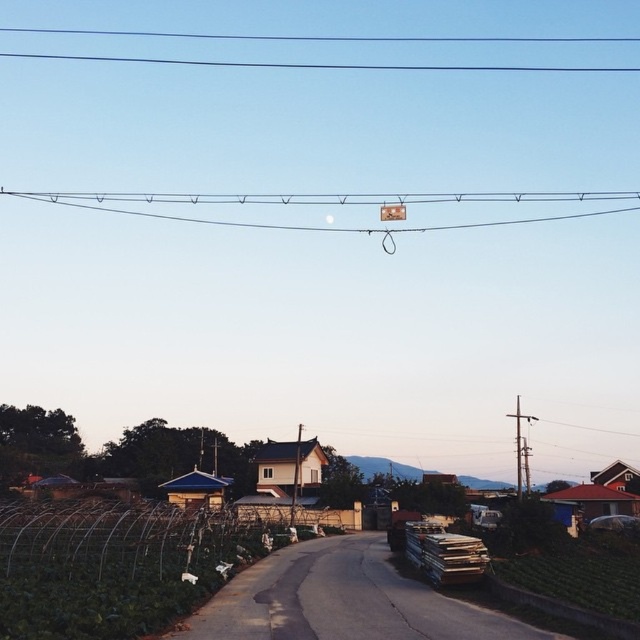
Does black wire at upper center come behind metallic rectangular sign at upper center?

Yes, it is.

Which is behind, point (506, 70) or point (396, 208)?

Positioned behind is point (506, 70).

Identify the location of black wire at upper center. The height and width of the screenshot is (640, 640). (x=326, y=36).

Who is positioned more to the left, black wire at upper center or metallic gray pole at right?

black wire at upper center is more to the left.

Who is more distant from viewer, (228, 65) or (525, 420)?

The point (228, 65) is behind.

Identify the location of black wire at upper center. The image size is (640, 640). (326, 36).

Is metallic silver car at right bigger than metallic rectangular sign at upper center?

Incorrect, metallic silver car at right is not larger than metallic rectangular sign at upper center.

Who is positioned more to the left, metallic silver car at right or metallic rectangular sign at upper center?

metallic rectangular sign at upper center is more to the left.

I want to click on metallic silver car at right, so click(612, 522).